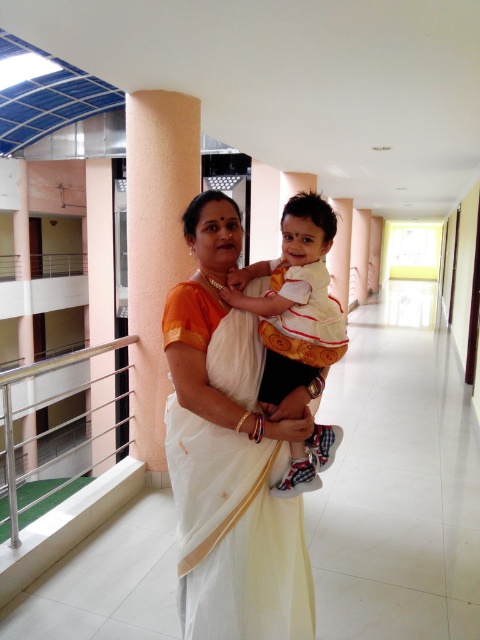
Can you confirm if white silk saree at center is taller than stainless steel balustrade at left?

No, white silk saree at center is not taller than stainless steel balustrade at left.

Who is taller, white silk saree at center or stainless steel balustrade at left?

With more height is stainless steel balustrade at left.

You are a GUI agent. You are given a task and a screenshot of the screen. Output one action in this format:
    pyautogui.click(x=<x>, y=<y>)
    Task: Click on the white silk saree at center
    The height and width of the screenshot is (640, 480).
    Given the screenshot: What is the action you would take?
    pyautogui.click(x=230, y=452)

Does point (197, 140) lie behind point (311, 461)?

Yes, it is behind point (311, 461).

Is orange textured pillar at center positioned behind white cotton shirt at center?

Yes.

What do you see at coordinates (156, 244) in the screenshot? The image size is (480, 640). I see `orange textured pillar at center` at bounding box center [156, 244].

You are a GUI agent. You are given a task and a screenshot of the screen. Output one action in this format:
    pyautogui.click(x=<x>, y=<y>)
    Task: Click on the orange textured pillar at center
    The image size is (480, 640).
    Given the screenshot: What is the action you would take?
    pyautogui.click(x=156, y=244)

Does white silk saree at center appear on the right side of orange textured pillar at center?

Correct, you'll find white silk saree at center to the right of orange textured pillar at center.

Is point (190, 563) positioned in front of point (171, 92)?

Yes, it is in front of point (171, 92).

In order to click on white silk saree at center in this screenshot , I will do `click(230, 452)`.

At what (x,y) coordinates should I click in order to perform the action: click on white silk saree at center. Please return your answer as a coordinate pair (x, y). Looking at the image, I should click on (230, 452).